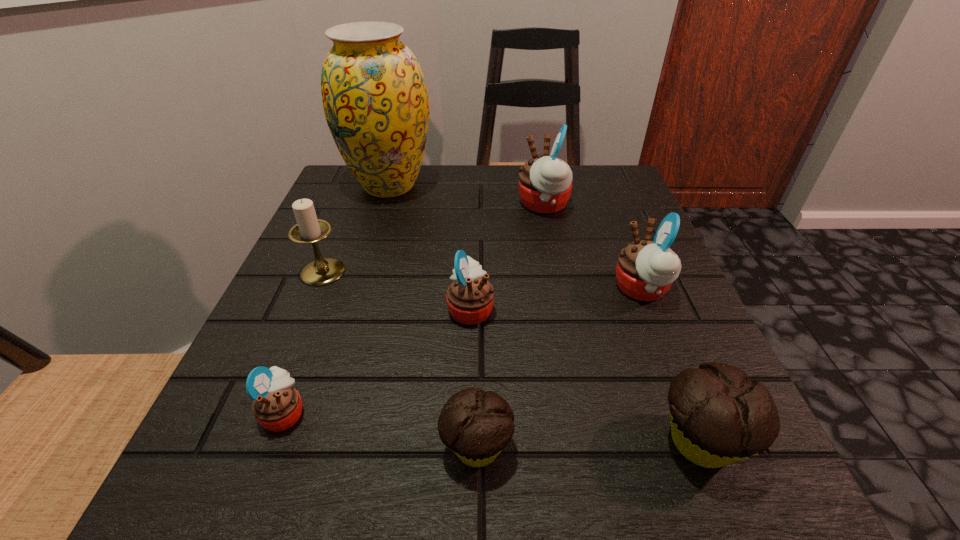
Where is `vacant area that lies between the right chocolate muffin and the fourth muffin from left to right`? This screenshot has width=960, height=540. vacant area that lies between the right chocolate muffin and the fourth muffin from left to right is located at coordinates (622, 323).

At what (x,y) coordinates should I click in order to perform the action: click on free point between the right chocolate muffin and the smaller chocolate muffin. Please return your answer as a coordinate pair (x, y). Looking at the image, I should click on (588, 444).

The image size is (960, 540). I want to click on free spot between the right chocolate muffin and the second biggest pink muffin, so click(x=671, y=365).

Where is `vacant space that's between the second pink muffin from left to right and the sixth object from left to right`? vacant space that's between the second pink muffin from left to right and the sixth object from left to right is located at coordinates (507, 256).

You are a GUI agent. You are given a task and a screenshot of the screen. Output one action in this format:
    pyautogui.click(x=<x>, y=<y>)
    Task: Click on the free space between the candle holder and the fourth muffin from left to right
    
    Given the screenshot: What is the action you would take?
    pyautogui.click(x=433, y=238)

At what (x,y) coordinates should I click in order to perform the action: click on vacant point located between the leftmost muffin and the left chocolate muffin. Please return your answer as a coordinate pair (x, y). Looking at the image, I should click on (380, 430).

Find the location of a particular element. The height and width of the screenshot is (540, 960). vacant area that lies between the bigger chocolate muffin and the rightmost pink muffin is located at coordinates (671, 365).

You are a GUI agent. You are given a task and a screenshot of the screen. Output one action in this format:
    pyautogui.click(x=<x>, y=<y>)
    Task: Click on the vacant space in between the tallest object and the second pink muffin from left to right
    This screenshot has width=960, height=540.
    Given the screenshot: What is the action you would take?
    pyautogui.click(x=430, y=247)

The image size is (960, 540). What are the coordinates of `object that stands as the second closest to the smallest pink muffin` in the screenshot? It's located at [x=470, y=297].

At what (x,y) coordinates should I click in order to perform the action: click on the third closest object relative to the yellow vase. Please return your answer as a coordinate pair (x, y). The image size is (960, 540). Looking at the image, I should click on (470, 297).